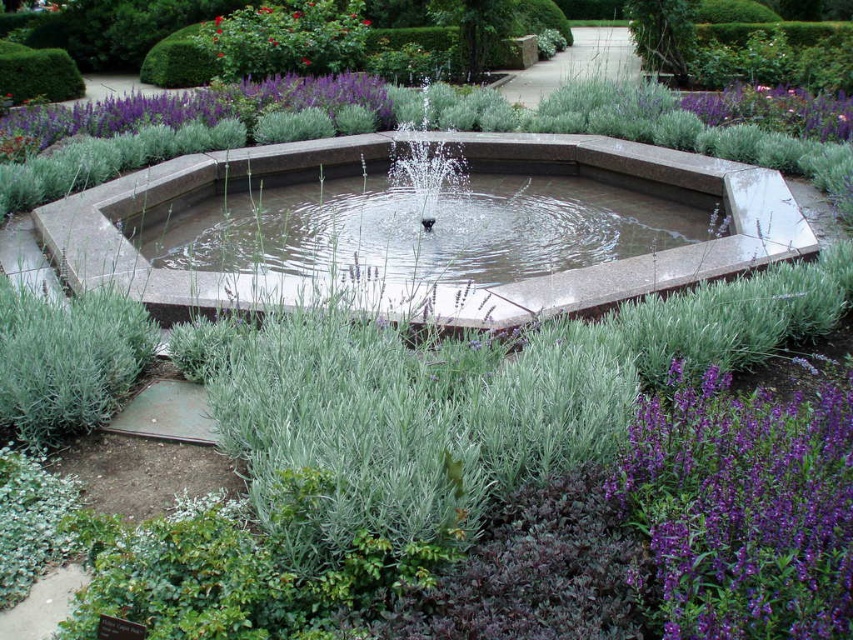
Question: Which point is farther from the camera taking this photo?

Choices:
 (A) (724, 92)
 (B) (692, 508)

Answer: (A)

Question: Among these objects, which one is nearest to the camera?

Choices:
 (A) purple soft lavender at upper right
 (B) purple soft-textured lavender at lower right

Answer: (B)

Question: Is purple soft-textured lavender at lower right thinner than purple soft lavender at upper right?

Choices:
 (A) no
 (B) yes

Answer: (B)

Question: Which point is farther to the camera?

Choices:
 (A) (721, 577)
 (B) (830, 131)

Answer: (B)

Question: Does purple soft-textured lavender at lower right appear on the left side of purple soft lavender at upper right?

Choices:
 (A) no
 (B) yes

Answer: (B)

Question: Is purple soft-textured lavender at lower right smaller than purple soft lavender at upper right?

Choices:
 (A) no
 (B) yes

Answer: (B)